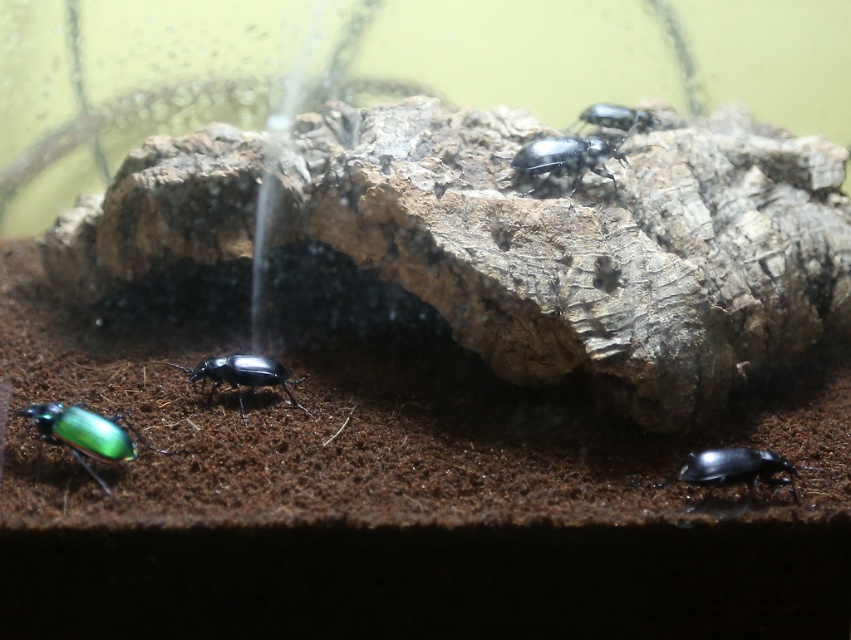
Question: Can you confirm if glossy black beetle at lower right is positioned to the right of glossy black beetle at center?

Choices:
 (A) no
 (B) yes

Answer: (B)

Question: Does green glossy beetle at lower left appear over shiny metallic beetle at center?

Choices:
 (A) no
 (B) yes

Answer: (A)

Question: Among these points, which one is nearest to the camera?

Choices:
 (A) (81, 422)
 (B) (614, 150)
 (C) (730, 483)
 (D) (615, 108)

Answer: (C)

Question: Which object appears farthest from the camera in this image?

Choices:
 (A) green glossy beetle at lower left
 (B) glossy black beetle at lower right

Answer: (B)

Question: Is glossy black beetle at lower right behind shiny metallic beetle at center?

Choices:
 (A) yes
 (B) no

Answer: (B)

Question: Which point is closer to the camera?

Choices:
 (A) glossy metallic beetle at upper center
 (B) glossy black beetle at lower right
 (C) shiny metallic beetle at center

Answer: (B)